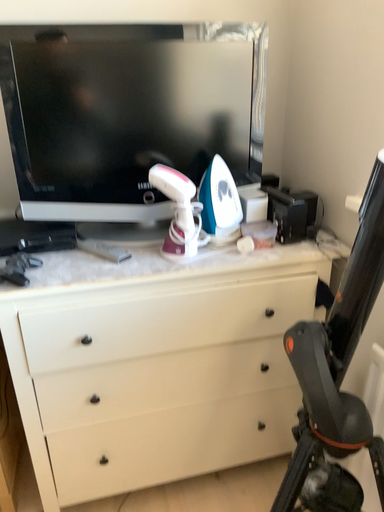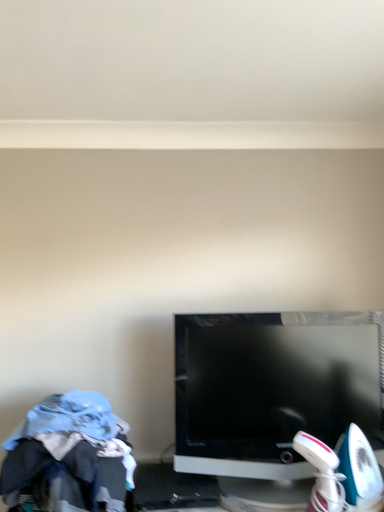
Question: How did the camera likely rotate when shooting the video?

Choices:
 (A) rotated right
 (B) rotated left

Answer: (B)